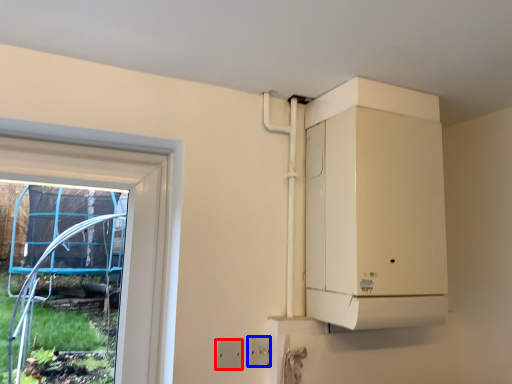
Question: Which object is further to the camera taking this photo, electric outlet (highlighted by a red box) or electric outlet (highlighted by a blue box)?

Choices:
 (A) electric outlet
 (B) electric outlet

Answer: (B)